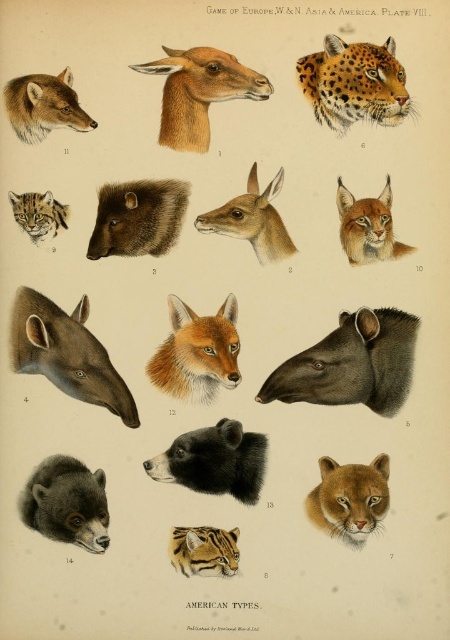
Does brown matte tapir head at center-left lie behind black fur bear at center?

Yes, brown matte tapir head at center-left is further from the viewer.

Based on the photo, is brown matte tapir head at center-left wider than black fur bear at center?

Yes, brown matte tapir head at center-left is wider than black fur bear at center.

Where is `brown matte tapir head at center-left`? Image resolution: width=450 pixels, height=640 pixels. brown matte tapir head at center-left is located at coordinates (66, 353).

Where is `brown matte tapir head at center-left`? This screenshot has width=450, height=640. brown matte tapir head at center-left is located at coordinates (66, 353).

Between brown furry animal at center-left and striped fur tiger at center, which one has less height?

With less height is striped fur tiger at center.

Between point (129, 246) and point (180, 532), which one is positioned behind?

The point (129, 246) is behind.

Find the location of a particular element. The image size is (450, 640). brown furry animal at center-left is located at coordinates (138, 218).

Does spotted fur leopard at upper right have a lesser height compared to black fur bear at center?

No.

Between spotted fur leopard at upper right and black fur bear at center, which one appears on the left side from the viewer's perspective?

Positioned to the left is black fur bear at center.

Describe the element at coordinates (354, 83) in the screenshot. This screenshot has height=640, width=450. I see `spotted fur leopard at upper right` at that location.

Locate an element on the screen. spotted fur leopard at upper right is located at coordinates tap(354, 83).